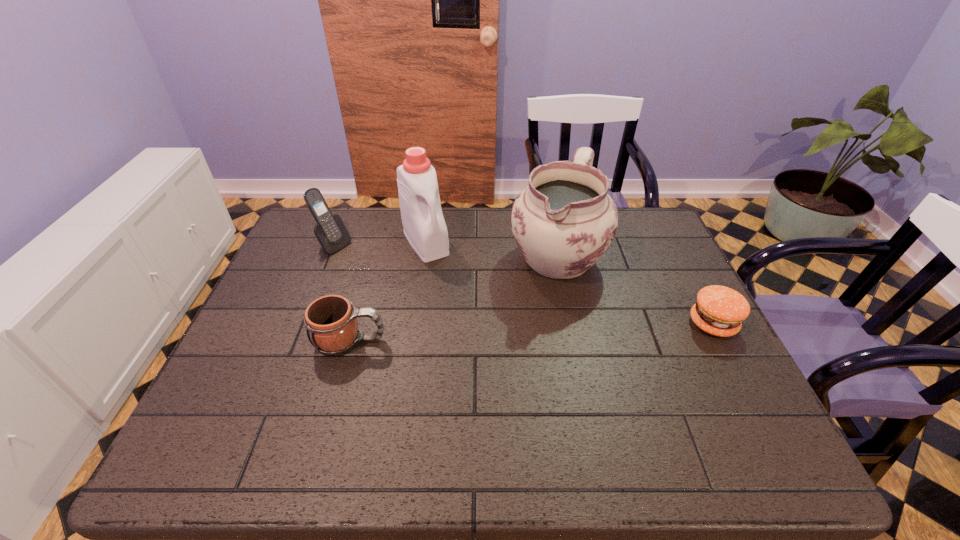
Identify the location of vacant space located on the spout of the fourth object from left to right. The image size is (960, 540). (503, 327).

Locate an element on the screen. free space located 0.180m on the spout of the fourth object from left to right is located at coordinates (501, 329).

Identify the location of vacant space situated on the spout of the fourth object from left to right. Image resolution: width=960 pixels, height=540 pixels. (508, 321).

Find the location of a particular element. free space located on the handle side of the detergent is located at coordinates point(485,337).

The width and height of the screenshot is (960, 540). Find the location of `vacant region located on the handle side of the detergent`. vacant region located on the handle side of the detergent is located at coordinates (489, 343).

Where is `vacant space positioned 0.360m on the handle side of the detergent`? vacant space positioned 0.360m on the handle side of the detergent is located at coordinates (491, 346).

The height and width of the screenshot is (540, 960). Find the location of `cellular telephone at the far edge`. cellular telephone at the far edge is located at coordinates (330, 231).

The image size is (960, 540). Find the location of `pitcher positioned at the far edge`. pitcher positioned at the far edge is located at coordinates (563, 222).

This screenshot has height=540, width=960. Identify the location of detergent at the far edge. (424, 226).

Image resolution: width=960 pixels, height=540 pixels. Find the location of `object that is at the left edge`. object that is at the left edge is located at coordinates (330, 231).